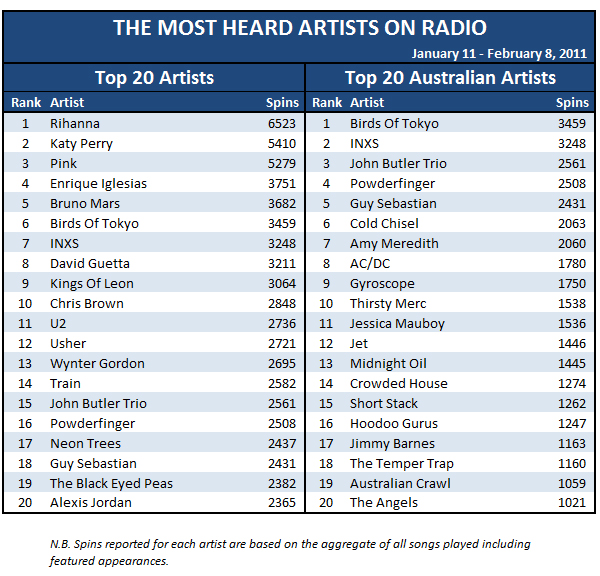
Locate an element on the screen. This screenshot has height=576, width=600. white bar is located at coordinates (215, 144), (216, 175), (216, 219), (213, 261), (203, 302), (205, 341), (204, 384), (203, 416), (211, 456), (208, 497).